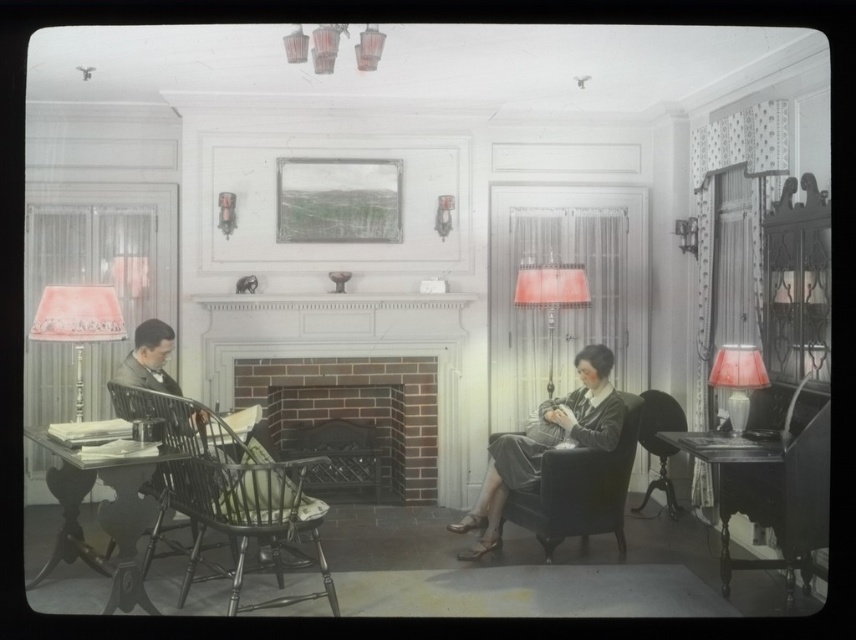
Does brick fireplace at center lie behind dark wood table at right?

Yes.

Describe the element at coordinates (355, 410) in the screenshot. The height and width of the screenshot is (640, 856). I see `brick fireplace at center` at that location.

At what (x,y) coordinates should I click in order to perform the action: click on brick fireplace at center. Please return your answer as a coordinate pair (x, y). Image resolution: width=856 pixels, height=640 pixels. Looking at the image, I should click on (355, 410).

Measure the distance from wooden table at left to matte red lampshade at center right.

wooden table at left is 2.65 meters from matte red lampshade at center right.

Is point (125, 525) positioned after point (519, 276)?

No, (125, 525) is in front of (519, 276).

Locate an element on the screen. wooden table at left is located at coordinates (117, 513).

Does wooden table at left have a lesser width compared to pink velvet lampshade at left?

In fact, wooden table at left might be wider than pink velvet lampshade at left.

Is wooden table at left wider than pink velvet lampshade at left?

Yes.

Is point (116, 547) positioned behind point (58, 340)?

Yes.

Where is `wooden table at left`? wooden table at left is located at coordinates (117, 513).